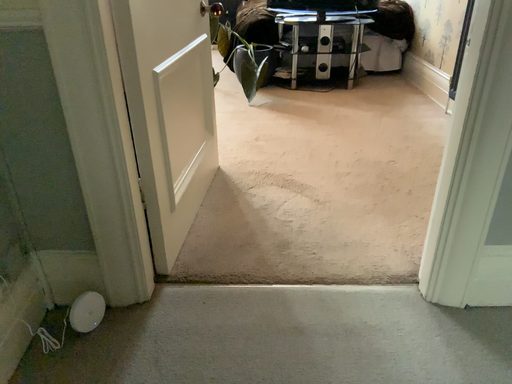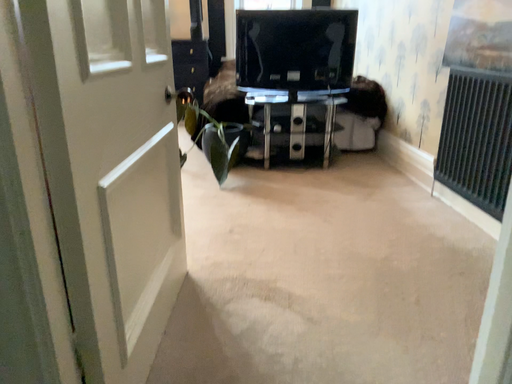
Question: Which way did the camera rotate in the video?

Choices:
 (A) rotated downward
 (B) rotated upward

Answer: (B)